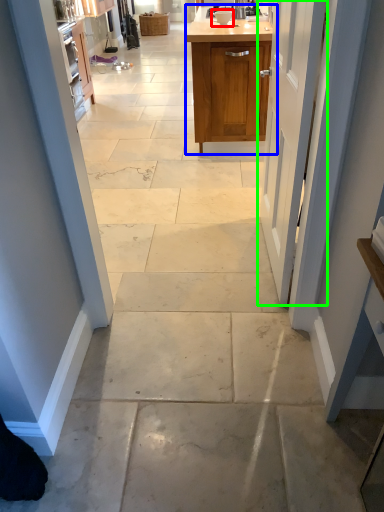
Question: Considering the real-world distances, which object is farthest from appliance (highlighted by a red box)? cabinetry (highlighted by a blue box) or door (highlighted by a green box)?

Choices:
 (A) cabinetry
 (B) door

Answer: (B)